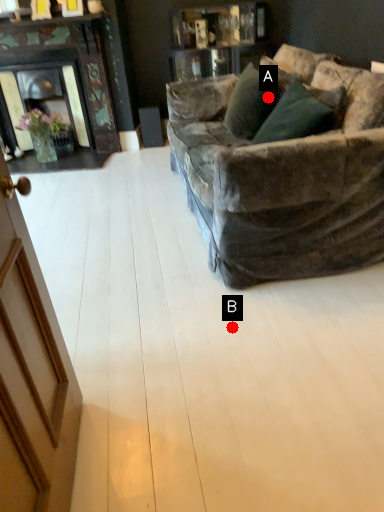
Question: Two points are circled on the image, labeled by A and B beside each circle. Which point is further to the camera?

Choices:
 (A) A is further
 (B) B is further

Answer: (A)